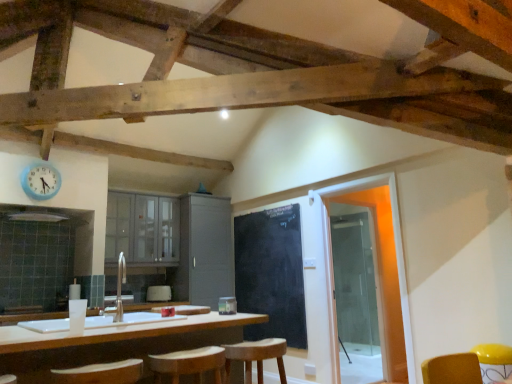
What do you see at coordinates (119, 332) in the screenshot? I see `white matte countertop at center` at bounding box center [119, 332].

In the scene shown: Measure the distance between blue plastic clock at upper left and camera.

The depth of blue plastic clock at upper left is 4.14 meters.

This screenshot has width=512, height=384. What do you see at coordinates (205, 250) in the screenshot? I see `matte gray cabinet at center, the 1th cabinetry positioned from the right` at bounding box center [205, 250].

You are a GUI agent. You are given a task and a screenshot of the screen. Output one action in this format:
    pyautogui.click(x=<x>, y=<y>)
    Task: Click on the white matte countertop at center
    The width and height of the screenshot is (512, 384).
    Given the screenshot: What is the action you would take?
    pyautogui.click(x=119, y=332)

In order to click on bulletin board behind the white matte countertop at center in this screenshot , I will do `click(271, 273)`.

Considering the relative positions of black chalkboard at center and white matte countertop at center in the image provided, is black chalkboard at center to the left of white matte countertop at center from the viewer's perspective?

Incorrect, black chalkboard at center is not on the left side of white matte countertop at center.

Is white matte countertop at center a part of black chalkboard at center?

No, white matte countertop at center is located outside of black chalkboard at center.

Considering their positions, is black chalkboard at center located in front of or behind white matte countertop at center?

Visually, black chalkboard at center is located behind white matte countertop at center.

From the image's perspective, is blue plastic clock at upper left positioned above or below transparent glass door at right?

Based on their image positions, blue plastic clock at upper left is located above transparent glass door at right.

Is blue plastic clock at upper left wider or thinner than transparent glass door at right?

Clearly, blue plastic clock at upper left has more width compared to transparent glass door at right.

Is the surface of blue plastic clock at upper left in direct contact with transparent glass door at right?

blue plastic clock at upper left is not next to transparent glass door at right, and they're not touching.

Can you tell me how much blue plastic clock at upper left and transparent glass door at right differ in facing direction?

blue plastic clock at upper left and transparent glass door at right are facing 1.32 degrees away from each other.

Can you tell me how much white matte countertop at center and blue plastic clock at upper left differ in facing direction?

The facing directions of white matte countertop at center and blue plastic clock at upper left are 0.621 degrees apart.

Is white matte countertop at center facing away from blue plastic clock at upper left?

white matte countertop at center does not have its back to blue plastic clock at upper left.

Based on their sizes in the image, would you say white matte countertop at center is bigger or smaller than blue plastic clock at upper left?

In the image, white matte countertop at center appears to be larger than blue plastic clock at upper left.

Looking at this image, from a real-world perspective, is white matte countertop at center located higher than blue plastic clock at upper left?

No, from a real-world perspective, white matte countertop at center is not above blue plastic clock at upper left.

Considering the positions of points (149, 296) and (42, 320), is point (149, 296) closer to camera compared to point (42, 320)?

No, it is not.

Do you think white fabric armchair at center is within white glossy sink at center, or outside of it?

white fabric armchair at center lies outside white glossy sink at center.

The height and width of the screenshot is (384, 512). I want to click on armchair that is under the white glossy sink at center (from a real-world perspective), so tap(159, 293).

Can you confirm if white fabric armchair at center is taller than white glossy sink at center?

Incorrect, the height of white fabric armchair at center is not larger of that of white glossy sink at center.

Who is more distant, white matte countertop at center or white fabric armchair at center?

white fabric armchair at center is further from the camera.

Locate an element on the screen. The image size is (512, 384). armchair below the white matte countertop at center (from the image's perspective) is located at coordinates (159, 293).

Which is further, (196, 324) or (170, 290)?

Positioned behind is point (170, 290).

From a real-world perspective, is matte gray cabinets at center, which is counted as the 2th cabinetry, starting from the right, located beneath white glossy sink at center?

Incorrect, from a real-world perspective, matte gray cabinets at center, which is counted as the 2th cabinetry, starting from the right, is higher than white glossy sink at center.

Who is smaller, matte gray cabinets at center, marked as the first cabinetry in a left-to-right arrangement, or white glossy sink at center?

white glossy sink at center.

Can you see matte gray cabinets at center, which is counted as the 2th cabinetry, starting from the right, touching white glossy sink at center?

No, matte gray cabinets at center, which is counted as the 2th cabinetry, starting from the right, is not with white glossy sink at center.

Which is less distant, (112,208) or (102,315)?

Clearly, point (112,208) is more distant from the camera than point (102,315).

Consider the image. Between white matte countertop at center and white glossy sink at center, which one has larger width?

white matte countertop at center.

The height and width of the screenshot is (384, 512). Find the location of `sink lying above the white matte countertop at center (from the image's perspective)`. sink lying above the white matte countertop at center (from the image's perspective) is located at coordinates (123, 316).

Based on the photo, considering the positions of objects white matte countertop at center and white glossy sink at center in the image provided, who is behind, white matte countertop at center or white glossy sink at center?

white glossy sink at center is further away from the camera.

Is the surface of white matte countertop at center in direct contact with white glossy sink at center?

No, white matte countertop at center is not in contact with white glossy sink at center.

You are a GUI agent. You are given a task and a screenshot of the screen. Output one action in this format:
    pyautogui.click(x=<x>, y=<y>)
    Task: Click on the countertop on the left of black chalkboard at center
    Image resolution: width=512 pixels, height=384 pixels.
    Given the screenshot: What is the action you would take?
    pyautogui.click(x=119, y=332)

Where is `glass door on the right of blue plastic clock at upper left`? glass door on the right of blue plastic clock at upper left is located at coordinates (357, 295).

When comparing their distances from matte gray cabinets at center, marked as the first cabinetry in a left-to-right arrangement, does white fabric armchair at center or white glossy sink at center seem further?

white glossy sink at center.

Considering their positions, is transparent glass door at right positioned closer to black chalkboard at center than matte gray cabinet at center, acting as the second cabinetry starting from the left?

A: Among the two, matte gray cabinet at center, acting as the second cabinetry starting from the left, is located nearer to black chalkboard at center.

From the image, which object appears to be nearer to matte gray cabinet at center, acting as the second cabinetry starting from the left, white matte countertop at center or blue plastic clock at upper left?

blue plastic clock at upper left.

Estimate the real-world distances between objects in this image. Which object is closer to white matte countertop at center, white fabric armchair at center or transparent glass door at right?

transparent glass door at right is closer to white matte countertop at center.

Estimate the real-world distances between objects in this image. Which object is further from transparent glass door at right, matte gray cabinet at center, acting as the second cabinetry starting from the left, or wooden bar stool at center?

wooden bar stool at center.

Estimate the real-world distances between objects in this image. Which object is further from white fabric armchair at center, wooden bar stool at center or matte gray cabinets at center, which is counted as the 2th cabinetry, starting from the right?

Based on the image, wooden bar stool at center appears to be further to white fabric armchair at center.

Based on their spatial positions, is white fabric armchair at center or blue plastic clock at upper left closer to white glossy sink at center?

blue plastic clock at upper left lies closer to white glossy sink at center than the other object.

From the image, which object appears to be nearer to wooden bar stool at center, white fabric armchair at center or matte gray cabinets at center, marked as the first cabinetry in a left-to-right arrangement?

Based on the image, white fabric armchair at center appears to be nearer to wooden bar stool at center.

Locate an element on the screen. The image size is (512, 384). glass door positioned between white matte countertop at center and black chalkboard at center from near to far is located at coordinates (357, 295).

This screenshot has width=512, height=384. Find the location of `cabinetry situated between matte gray cabinets at center, which is counted as the 2th cabinetry, starting from the right, and black chalkboard at center from left to right`. cabinetry situated between matte gray cabinets at center, which is counted as the 2th cabinetry, starting from the right, and black chalkboard at center from left to right is located at coordinates (205, 250).

Identify the location of bulletin board between white matte countertop at center and matte gray cabinets at center, marked as the first cabinetry in a left-to-right arrangement, from front to back. (271, 273).

The height and width of the screenshot is (384, 512). Find the location of `glass door between white matte countertop at center and matte gray cabinet at center, acting as the second cabinetry starting from the left, in the front-back direction`. glass door between white matte countertop at center and matte gray cabinet at center, acting as the second cabinetry starting from the left, in the front-back direction is located at coordinates (357, 295).